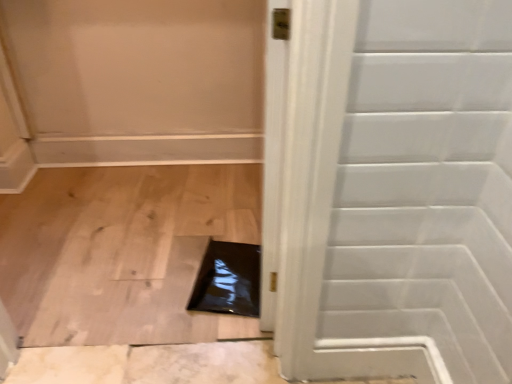
Locate an element on the screen. Image resolution: width=512 pixels, height=384 pixels. vacant region in front of black glossy hole at center is located at coordinates (206, 325).